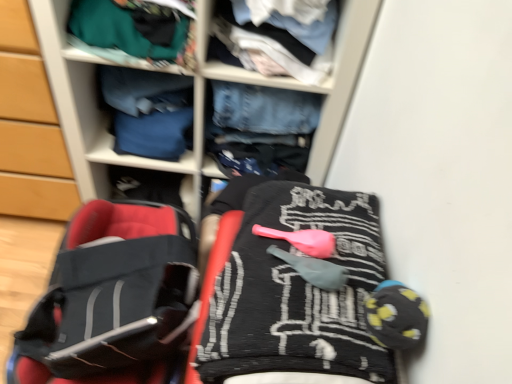
Question: Does black textured blanket at center, which is the 1th clothing in front-to-back order, come in front of denim jeans at center?

Choices:
 (A) no
 (B) yes

Answer: (B)

Question: Is black textured blanket at center, which is the 1th clothing in front-to-back order, facing towards denim jeans at center?

Choices:
 (A) no
 (B) yes

Answer: (A)

Question: Is denim jeans at center surrounded by black textured blanket at center, the fourth clothing in the back-to-front sequence?

Choices:
 (A) yes
 (B) no

Answer: (B)

Question: Does black textured blanket at center, the fourth clothing in the back-to-front sequence, lie behind denim jeans at center?

Choices:
 (A) yes
 (B) no

Answer: (B)

Question: From the image's perspective, is black textured blanket at center, the fourth clothing in the back-to-front sequence, under denim jeans at center?

Choices:
 (A) no
 (B) yes

Answer: (B)

Question: In the image, is light blue cotton shirt at upper center, which is the second clothing in front-to-back order, positioned in front of or behind denim jeans at center?

Choices:
 (A) front
 (B) behind

Answer: (B)

Question: From a real-world perspective, is light blue cotton shirt at upper center, which is the second clothing in front-to-back order, above or below denim jeans at center?

Choices:
 (A) above
 (B) below

Answer: (A)

Question: Is light blue cotton shirt at upper center, which is counted as the third clothing, starting from the back, situated inside denim jeans at center or outside?

Choices:
 (A) outside
 (B) inside

Answer: (B)

Question: Does point (313, 11) appear closer or farther from the camera than point (202, 21)?

Choices:
 (A) closer
 (B) farther

Answer: (B)

Question: From the image's perspective, is black textured blanket at center, which is the 1th clothing in front-to-back order, located above or below wooden cabinet at left?

Choices:
 (A) above
 (B) below

Answer: (B)

Question: Considering the positions of black textured blanket at center, which is the 1th clothing in front-to-back order, and wooden cabinet at left in the image, is black textured blanket at center, which is the 1th clothing in front-to-back order, taller or shorter than wooden cabinet at left?

Choices:
 (A) short
 (B) tall

Answer: (A)

Question: Looking at their shapes, would you say black textured blanket at center, the fourth clothing in the back-to-front sequence, is wider or thinner than wooden cabinet at left?

Choices:
 (A) wide
 (B) thin

Answer: (B)

Question: In the image, is black textured blanket at center, the fourth clothing in the back-to-front sequence, positioned in front of or behind wooden cabinet at left?

Choices:
 (A) front
 (B) behind

Answer: (A)

Question: Relative to black fabric baby carriage at lower left, is light blue cotton shirt at upper center, which is counted as the third clothing, starting from the back, in front or behind?

Choices:
 (A) front
 (B) behind

Answer: (A)

Question: Is light blue cotton shirt at upper center, which is the second clothing in front-to-back order, to the left or to the right of black fabric baby carriage at lower left in the image?

Choices:
 (A) right
 (B) left

Answer: (A)